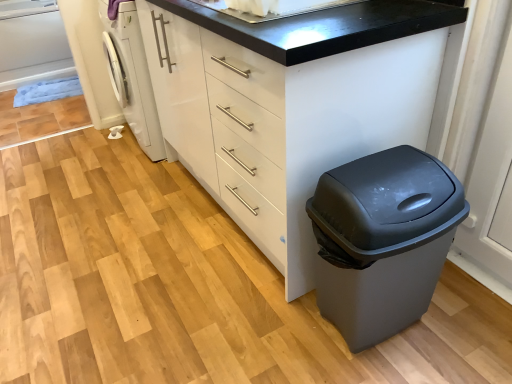
Question: Considering the relative sizes of white glossy sink at upper center and white glossy washing machine at left in the image provided, is white glossy sink at upper center smaller than white glossy washing machine at left?

Choices:
 (A) yes
 (B) no

Answer: (A)

Question: Is the depth of white glossy sink at upper center less than that of white glossy washing machine at left?

Choices:
 (A) no
 (B) yes

Answer: (B)

Question: Is white glossy sink at upper center aimed at white glossy washing machine at left?

Choices:
 (A) no
 (B) yes

Answer: (A)

Question: Is white glossy sink at upper center outside white glossy washing machine at left?

Choices:
 (A) yes
 (B) no

Answer: (A)

Question: Considering the relative sizes of white glossy sink at upper center and white glossy washing machine at left in the image provided, is white glossy sink at upper center thinner than white glossy washing machine at left?

Choices:
 (A) no
 (B) yes

Answer: (A)

Question: Is white glossy sink at upper center further to the viewer compared to white glossy washing machine at left?

Choices:
 (A) no
 (B) yes

Answer: (A)

Question: Does white matte chest of drawers at center touch white glossy sink at upper center?

Choices:
 (A) no
 (B) yes

Answer: (A)

Question: Is white glossy sink at upper center a part of white matte chest of drawers at center?

Choices:
 (A) yes
 (B) no

Answer: (B)

Question: From a real-world perspective, is white matte chest of drawers at center positioned under white glossy sink at upper center based on gravity?

Choices:
 (A) no
 (B) yes

Answer: (B)

Question: From a real-world perspective, is white matte chest of drawers at center physically above white glossy sink at upper center?

Choices:
 (A) no
 (B) yes

Answer: (A)

Question: Is white matte chest of drawers at center not inside white glossy sink at upper center?

Choices:
 (A) yes
 (B) no

Answer: (A)

Question: Is white matte chest of drawers at center shorter than white glossy sink at upper center?

Choices:
 (A) yes
 (B) no

Answer: (B)

Question: Is white glossy washing machine at left thinner than white glossy sink at upper center?

Choices:
 (A) no
 (B) yes

Answer: (B)